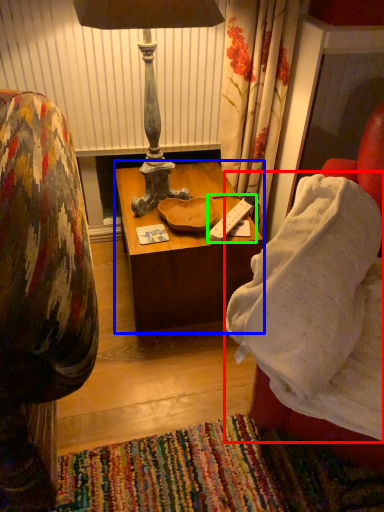
Question: Considering the real-world distances, which object is closest to blanket (highlighted by a red box)? table (highlighted by a blue box) or remote (highlighted by a green box).

Choices:
 (A) table
 (B) remote

Answer: (B)